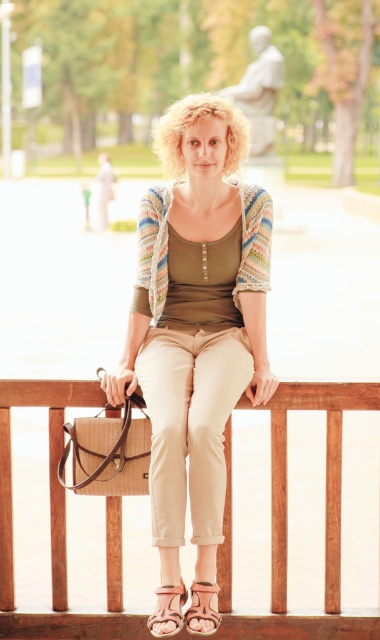
You are standing in the park and see the wooden fence at lower center and the leather sandals at lower center. Which object is positioned to the right when viewed from your perspective?

The wooden fence at lower center is to the right of the leather sandals at lower center, so the wooden fence at lower center is positioned to the right.